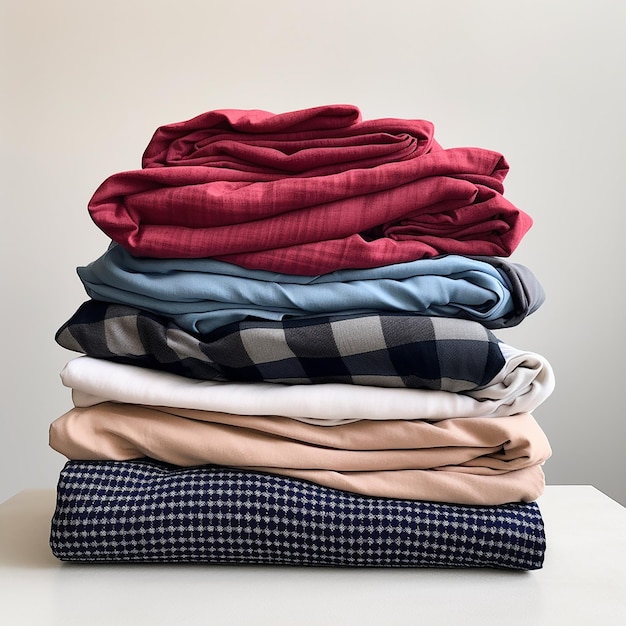
Find the location of a particular element. This screenshot has height=626, width=626. fabric is located at coordinates (292, 521), (374, 471), (342, 404), (337, 357), (300, 299), (304, 227), (310, 151).